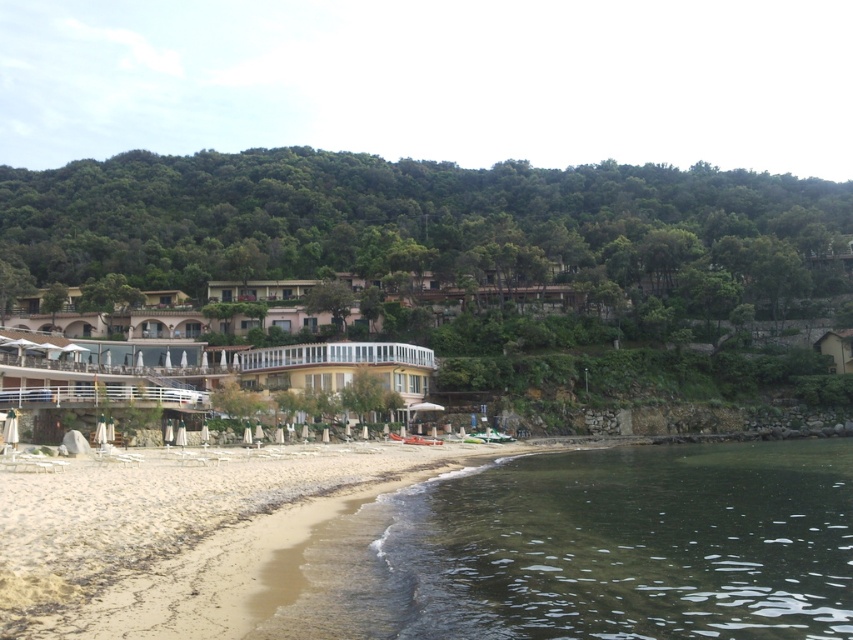
Question: Which object is closer to the camera taking this photo?

Choices:
 (A) green leafy hillside at upper center
 (B) white glass hotel at center

Answer: (B)

Question: Is clear water at lower right bigger than green leafy hillside at upper center?

Choices:
 (A) no
 (B) yes

Answer: (A)

Question: Where is green leafy hillside at upper center located in relation to white glass hotel at center in the image?

Choices:
 (A) above
 (B) below

Answer: (A)

Question: Which point is closer to the camera?

Choices:
 (A) (262, 483)
 (B) (254, 360)
 (C) (107, 196)

Answer: (A)

Question: Which object appears closest to the camera in this image?

Choices:
 (A) green leafy hillside at upper center
 (B) light brown sand at lower left

Answer: (B)

Question: Does light brown sand at lower left appear under white glass hotel at center?

Choices:
 (A) no
 (B) yes

Answer: (B)